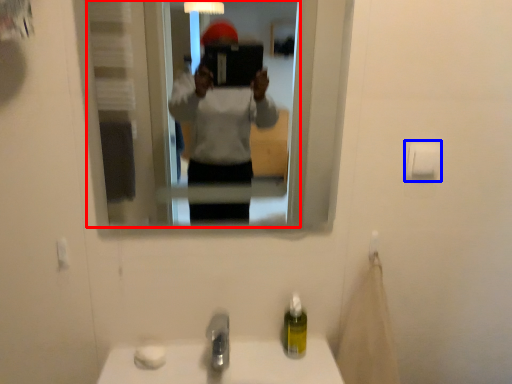
Question: Which object is further to the camera taking this photo, mirror (highlighted by a red box) or toilet paper (highlighted by a blue box)?

Choices:
 (A) mirror
 (B) toilet paper

Answer: (B)